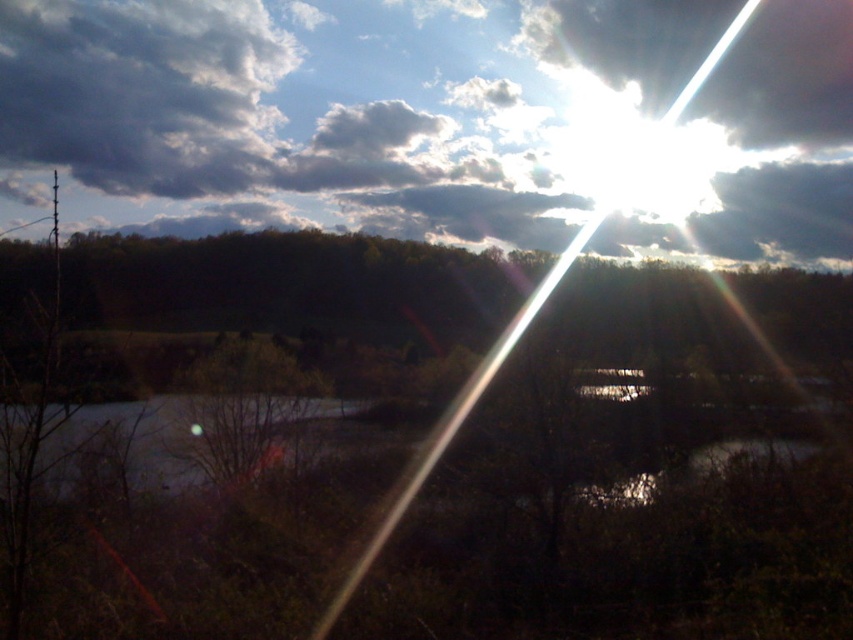
Question: Where is brown matte tree at center located in relation to cloudy sky at upper center in the image?

Choices:
 (A) right
 (B) left

Answer: (A)

Question: Among these points, which one is farthest from the camera?

Choices:
 (A) (276, 406)
 (B) (653, 388)

Answer: (A)

Question: Among these points, which one is farthest from the camera?

Choices:
 (A) (126, 416)
 (B) (289, 368)

Answer: (B)

Question: Can you confirm if cloudy sky at upper center is positioned above smooth gray water at center?

Choices:
 (A) yes
 (B) no

Answer: (A)

Question: From the image, what is the correct spatial relationship of cloudy sky at upper center in relation to smooth gray water at center?

Choices:
 (A) left
 (B) right

Answer: (B)

Question: Among these points, which one is nearest to the camera?

Choices:
 (A) (163, 124)
 (B) (834, 540)
 (C) (234, 401)

Answer: (B)